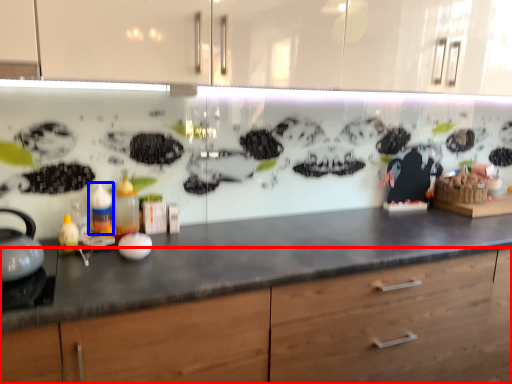
Question: Which object is further to the camera taking this photo, cabinetry (highlighted by a red box) or bottle (highlighted by a blue box)?

Choices:
 (A) cabinetry
 (B) bottle

Answer: (B)